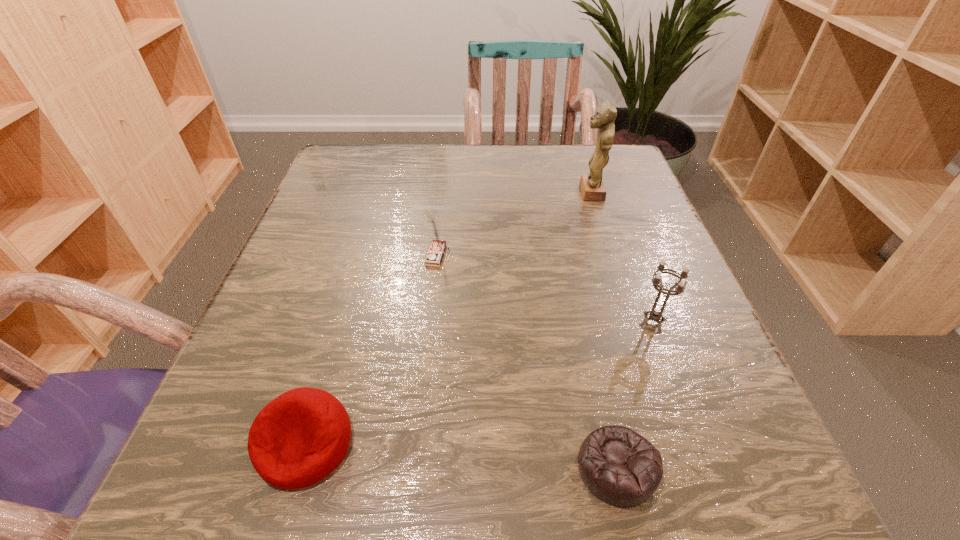
The height and width of the screenshot is (540, 960). In order to click on figurine in this screenshot , I will do `click(592, 187)`.

Identify the location of the tallest object. (592, 187).

Identify the location of matchbox. Image resolution: width=960 pixels, height=540 pixels. (435, 253).

In order to click on the second farthest object in this screenshot , I will do `click(435, 253)`.

This screenshot has width=960, height=540. I want to click on candle holder, so click(x=654, y=315).

Find the location of a particular element. The height and width of the screenshot is (540, 960). the taller beanbag is located at coordinates (299, 438).

The width and height of the screenshot is (960, 540). Identify the location of the left beanbag. (299, 438).

Locate an element on the screen. This screenshot has height=540, width=960. the shortest object is located at coordinates (619, 466).

Locate an element on the screen. The width and height of the screenshot is (960, 540). the right beanbag is located at coordinates (619, 466).

Identify the location of vacant point located on the front-facing side of the figurine. The height and width of the screenshot is (540, 960). (540, 192).